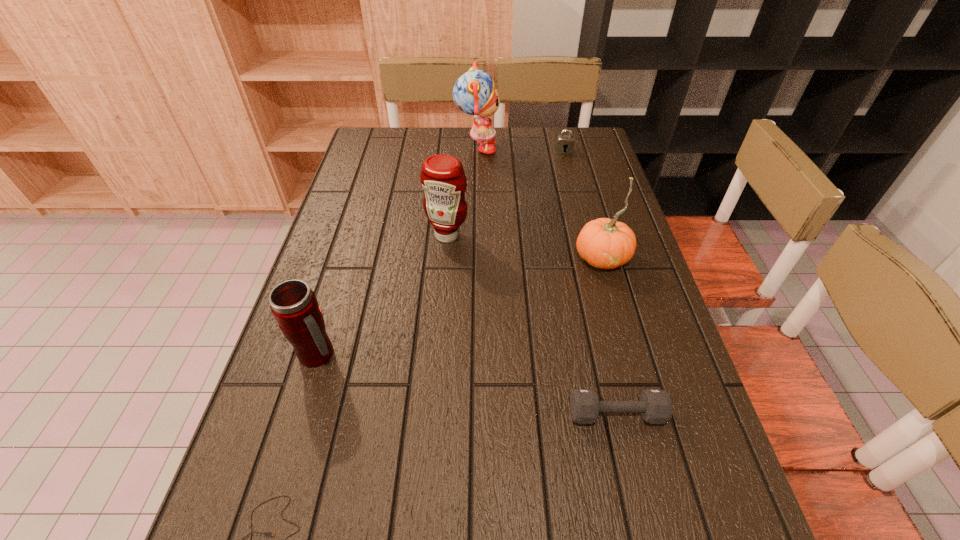
You are a GUI agent. You are given a task and a screenshot of the screen. Output one action in this format:
    pyautogui.click(x=<x>, y=<y>)
    Task: Click on the free space located 0.170m on the side with the handle of the thermos bottle
    The width and height of the screenshot is (960, 540).
    Given the screenshot: What is the action you would take?
    pyautogui.click(x=420, y=355)

At what (x,y) coordinates should I click in order to perform the action: click on free region located 0.370m at the front of the padlock near the keyhole. Please return your answer as a coordinate pair (x, y). This screenshot has width=960, height=540. Looking at the image, I should click on (582, 222).

I want to click on free space located 0.150m on the left of the dumbbell, so click(x=493, y=414).

Where is `doll that is at the far edge`? This screenshot has width=960, height=540. doll that is at the far edge is located at coordinates (475, 93).

Locate an element on the screen. The width and height of the screenshot is (960, 540). padlock present at the far edge is located at coordinates (564, 143).

Find the location of a particular element. Image resolution: width=960 pixels, height=540 pixels. object at the left edge is located at coordinates (293, 304).

The width and height of the screenshot is (960, 540). I want to click on pumpkin that is at the right edge, so click(x=604, y=243).

Identify the location of padlock that is at the right edge. The height and width of the screenshot is (540, 960). point(564,143).

The width and height of the screenshot is (960, 540). What are the coordinates of `dumbbell that is at the right edge` in the screenshot? It's located at (655, 405).

This screenshot has width=960, height=540. I want to click on object at the far right corner, so click(564, 143).